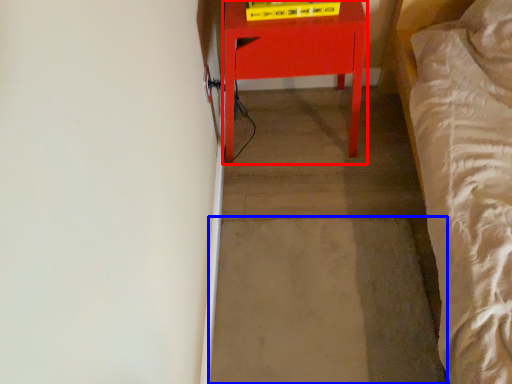
Question: Which of the following is the closest to the observer, furniture (highlighted by a red box) or concrete (highlighted by a blue box)?

Choices:
 (A) furniture
 (B) concrete

Answer: (A)